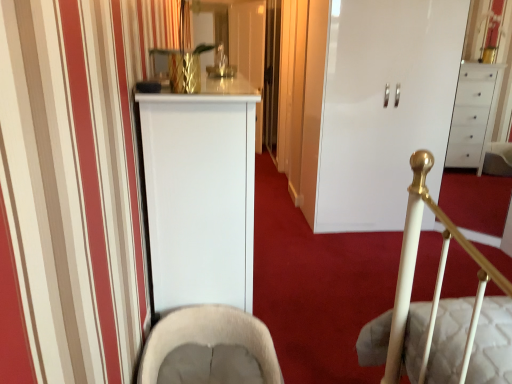
Question: Is white glossy cabinet at center shorter than beige fabric rocking chair at lower center?

Choices:
 (A) no
 (B) yes

Answer: (A)

Question: Considering the relative sizes of white glossy cabinet at center and beige fabric rocking chair at lower center in the image provided, is white glossy cabinet at center thinner than beige fabric rocking chair at lower center?

Choices:
 (A) yes
 (B) no

Answer: (B)

Question: Is the position of white glossy cabinet at center more distant than that of beige fabric rocking chair at lower center?

Choices:
 (A) yes
 (B) no

Answer: (A)

Question: From the image's perspective, is white glossy cabinet at center on top of beige fabric rocking chair at lower center?

Choices:
 (A) no
 (B) yes

Answer: (B)

Question: Is white glossy cabinet at center looking in the opposite direction of beige fabric rocking chair at lower center?

Choices:
 (A) yes
 (B) no

Answer: (B)

Question: Considering the relative sizes of white glossy cabinet at center and beige fabric rocking chair at lower center in the image provided, is white glossy cabinet at center wider than beige fabric rocking chair at lower center?

Choices:
 (A) yes
 (B) no

Answer: (A)

Question: Is beige fabric rocking chair at lower center aimed at white glossy cabinet at center?

Choices:
 (A) yes
 (B) no

Answer: (B)

Question: From the image's perspective, does beige fabric rocking chair at lower center appear lower than white glossy cabinet at center?

Choices:
 (A) yes
 (B) no

Answer: (A)

Question: Is beige fabric rocking chair at lower center looking in the opposite direction of white glossy cabinet at center?

Choices:
 (A) no
 (B) yes

Answer: (A)

Question: From a real-world perspective, does beige fabric rocking chair at lower center stand above white glossy cabinet at center?

Choices:
 (A) yes
 (B) no

Answer: (B)

Question: Is beige fabric rocking chair at lower center next to white glossy cabinet at center and touching it?

Choices:
 (A) no
 (B) yes

Answer: (A)

Question: Can you confirm if beige fabric rocking chair at lower center is positioned to the right of white glossy cabinet at center?

Choices:
 (A) no
 (B) yes

Answer: (A)

Question: Considering the positions of beige fabric rocking chair at lower center and white glossy cabinet at center in the image, is beige fabric rocking chair at lower center wider or thinner than white glossy cabinet at center?

Choices:
 (A) thin
 (B) wide

Answer: (A)